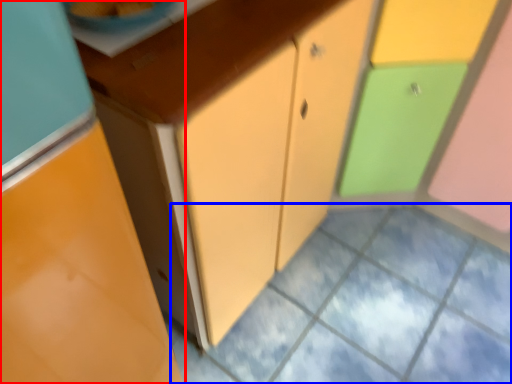
Question: Among these objects, which one is nearest to the camera, cabinetry (highlighted by a red box) or square (highlighted by a blue box)?

Choices:
 (A) cabinetry
 (B) square

Answer: (A)